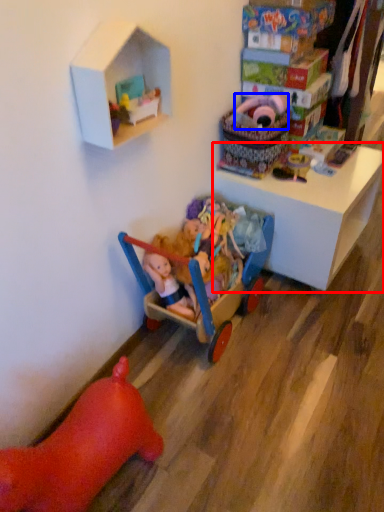
Question: Which object appears farthest to the camera in this image, table (highlighted by a red box) or toy (highlighted by a blue box)?

Choices:
 (A) table
 (B) toy

Answer: (A)